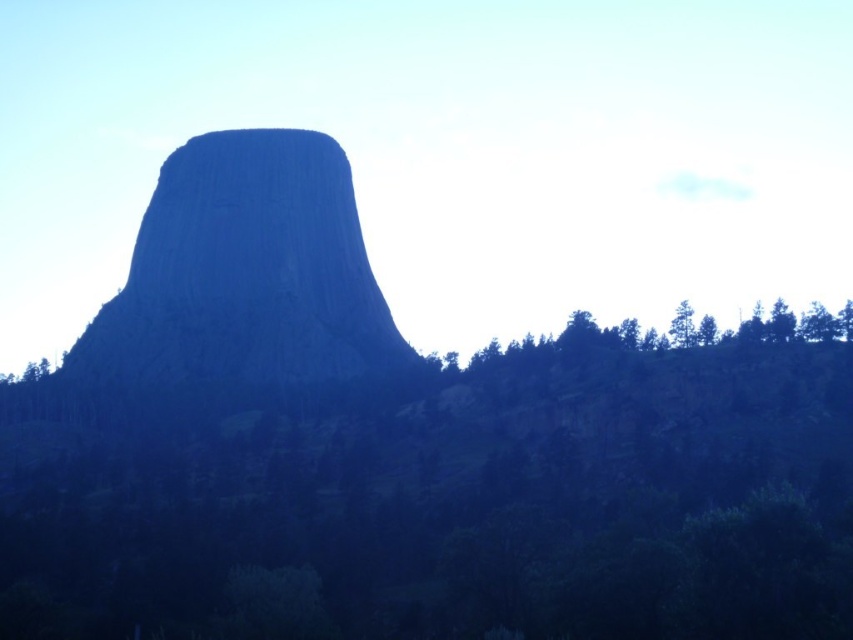
Is green leafy trees at lower right below green leafy tree at upper right?

Indeed, green leafy trees at lower right is positioned under green leafy tree at upper right.

In the scene shown: Who is more distant from viewer, [750,323] or [683,310]?

The point [683,310] is behind.

The height and width of the screenshot is (640, 853). In order to click on green leafy trees at lower right in this screenshot , I will do `click(671, 339)`.

Which is more to the left, rugged stone mountain at center or green leafy tree at upper right?

rugged stone mountain at center

Can you confirm if rugged stone mountain at center is taller than green leafy tree at upper right?

Yes.

Which is behind, point (161, 260) or point (689, 337)?

Positioned behind is point (161, 260).

This screenshot has width=853, height=640. In order to click on rugged stone mountain at center in this screenshot , I will do `click(242, 289)`.

Who is shorter, rugged stone mountain at center or green leafy trees at lower right?

With less height is green leafy trees at lower right.

Does rugged stone mountain at center lie in front of green leafy trees at lower right?

That is False.

Is point (340, 384) farther from camera compared to point (712, 333)?

Yes, it is behind point (712, 333).

This screenshot has width=853, height=640. What are the coordinates of `rugged stone mountain at center` in the screenshot? It's located at (242, 289).